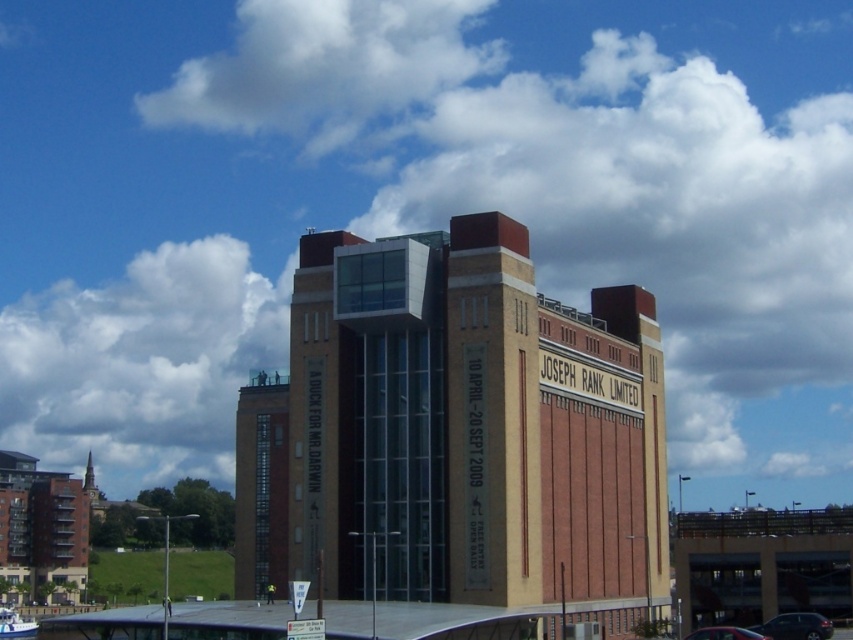
You are standing in front of the building and notice a point marked at coordinates [141,364]. What object is located at that point?

The point at coordinates 0.566, 0.166 corresponds to a white fluffy cloud at upper left.

You are a photographer planning to take a wide shot of the building. You have two cars in the scene, a shiny black car at lower right and a metallic silver car at center. Which car should you position closer to the building to ensure both fit in the frame without overlapping?

Since the shiny black car at lower right is thinner than the metallic silver car at center, positioning the shiny black car at lower right closer to the building would allow more space for the wider metallic silver car at center, ensuring both fit without overlapping.